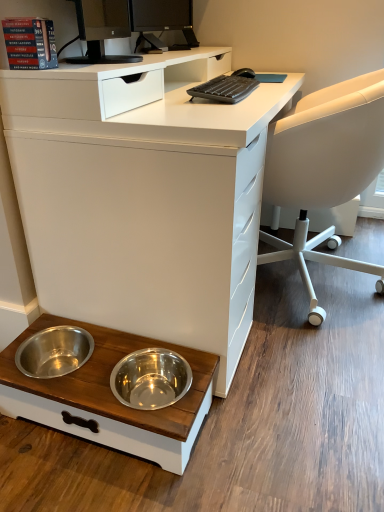
Locate an element on the screen. Image resolution: width=384 pixels, height=512 pixels. free space that is in between white plastic chair at right and white matte desk at lower left is located at coordinates (303, 349).